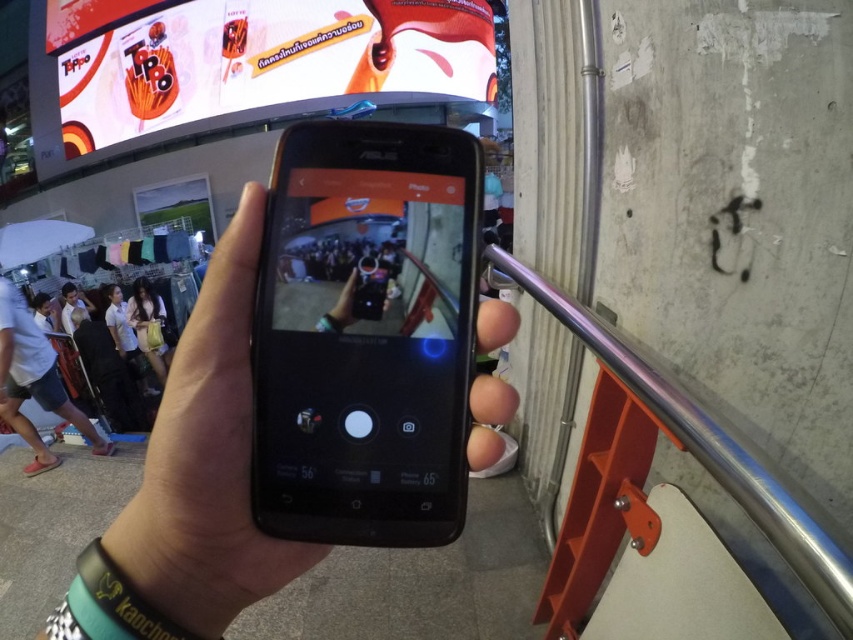
Question: Considering the relative positions of metallic silver rail at right and black matte phone at center in the image provided, where is metallic silver rail at right located with respect to black matte phone at center?

Choices:
 (A) right
 (B) left

Answer: (A)

Question: Estimate the real-world distances between objects in this image. Which object is closer to the black matte phone at center?

Choices:
 (A) black matte smartphone at center
 (B) matte black dress at center
 (C) metallic silver rail at right
 (D) white shirt at center

Answer: (A)

Question: Which point is farther to the camera?

Choices:
 (A) (64, 284)
 (B) (410, 454)

Answer: (A)

Question: Estimate the real-world distances between objects in this image. Which object is farther from the black matte smartphone at center?

Choices:
 (A) white shirt at center
 (B) metallic silver rail at right
 (C) black matte phone at center
 (D) matte black dress at center

Answer: (A)

Question: Is metallic silver rail at right positioned in front of matte black dress at center?

Choices:
 (A) yes
 (B) no

Answer: (A)

Question: Where is black matte phone at center located in relation to white shirt at center in the image?

Choices:
 (A) above
 (B) below

Answer: (B)